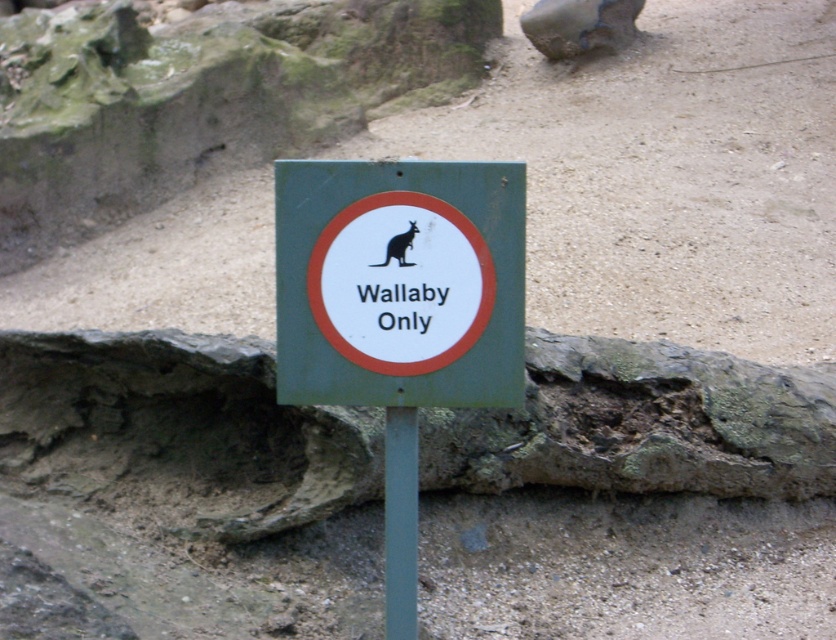
Measure the distance between green matte sign at center and camera.

The distance of green matte sign at center from camera is 3.33 meters.

Is green matte sign at center smaller than brown fur wallaby at center?

No.

The height and width of the screenshot is (640, 836). What do you see at coordinates (399, 308) in the screenshot? I see `green matte sign at center` at bounding box center [399, 308].

Image resolution: width=836 pixels, height=640 pixels. Find the location of `green matte sign at center`. green matte sign at center is located at coordinates (399, 308).

Who is more distant from viewer, (386,532) or (411,230)?

The point (386,532) is more distant.

Does green metallic pole at center have a greater height compared to brown fur wallaby at center?

Correct, green metallic pole at center is much taller as brown fur wallaby at center.

Where is `green metallic pole at center`? This screenshot has height=640, width=836. green metallic pole at center is located at coordinates (400, 522).

Where is `green metallic pole at center`? The height and width of the screenshot is (640, 836). green metallic pole at center is located at coordinates (400, 522).

The height and width of the screenshot is (640, 836). Find the location of `green matte sign at center`. green matte sign at center is located at coordinates (399, 308).

Is point (436, 168) less distant than point (405, 548)?

Yes, point (436, 168) is in front of point (405, 548).

What are the coordinates of `green matte sign at center` in the screenshot? It's located at (399, 308).